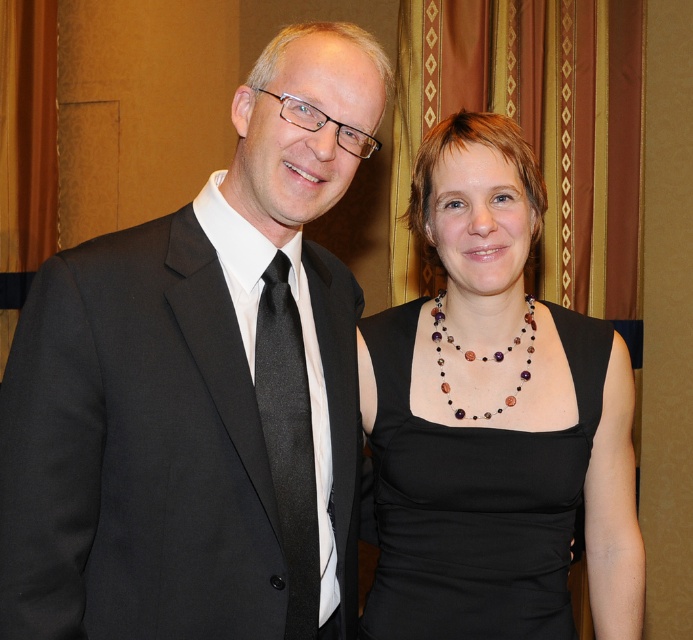
Question: Which point is closer to the camera?

Choices:
 (A) black silk tie at left
 (B) black satin suit at center

Answer: (B)

Question: Considering the real-world distances, which object is closest to the multicolored beaded necklace at center?

Choices:
 (A) black silk tie at left
 (B) black satin suit at center

Answer: (A)

Question: Which of the following is the farthest from the observer?

Choices:
 (A) (306, 616)
 (B) (292, 35)

Answer: (A)

Question: Does black matte dress at center have a smaller size compared to multicolored beaded necklace at center?

Choices:
 (A) no
 (B) yes

Answer: (A)

Question: Is black matte dress at center in front of black silk tie at left?

Choices:
 (A) no
 (B) yes

Answer: (A)

Question: In this image, where is black satin suit at center located relative to multicolored beaded necklace at center?

Choices:
 (A) left
 (B) right

Answer: (A)